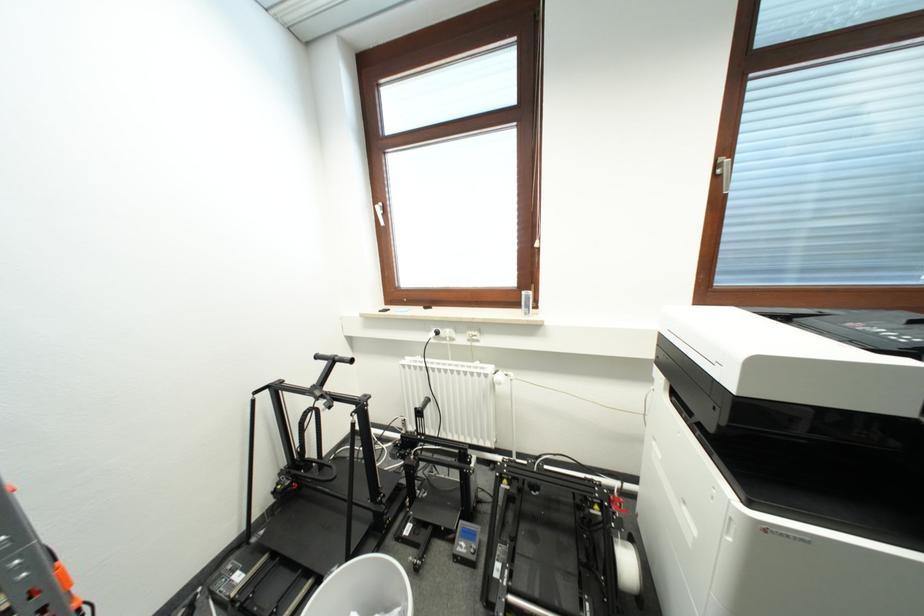
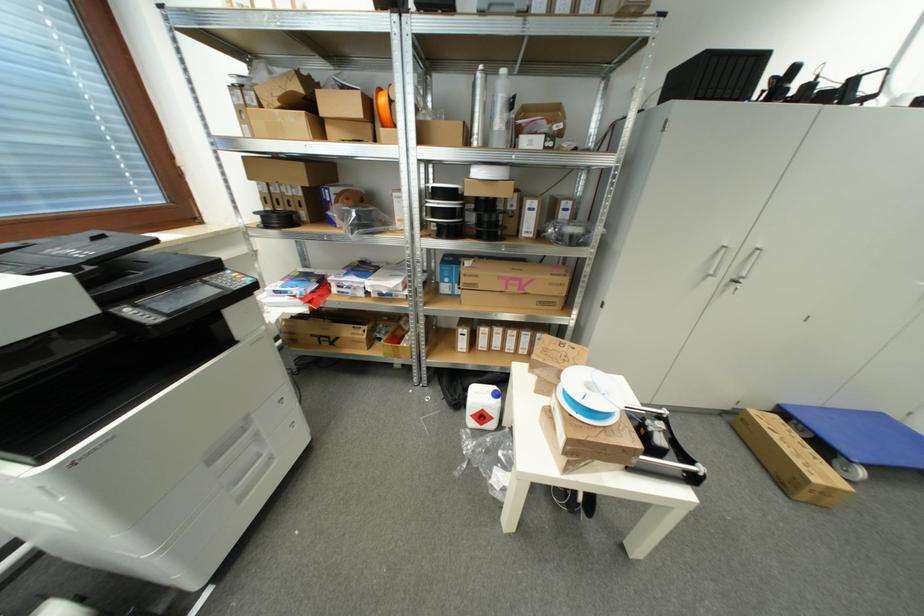
The images are taken continuously from a first-person perspective. In which direction is your viewpoint rotating?

The camera rotated toward right-down.